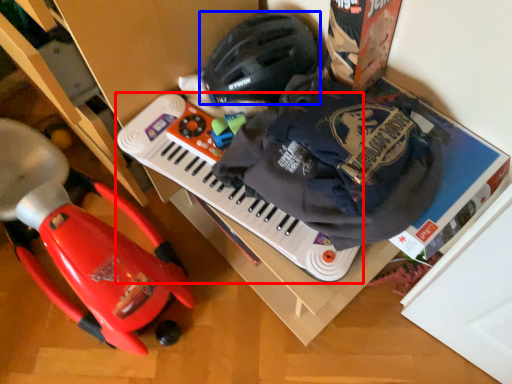
Question: Which of the following is the farthest to the observer, musical keyboard (highlighted by a red box) or helmet (highlighted by a blue box)?

Choices:
 (A) musical keyboard
 (B) helmet

Answer: (B)